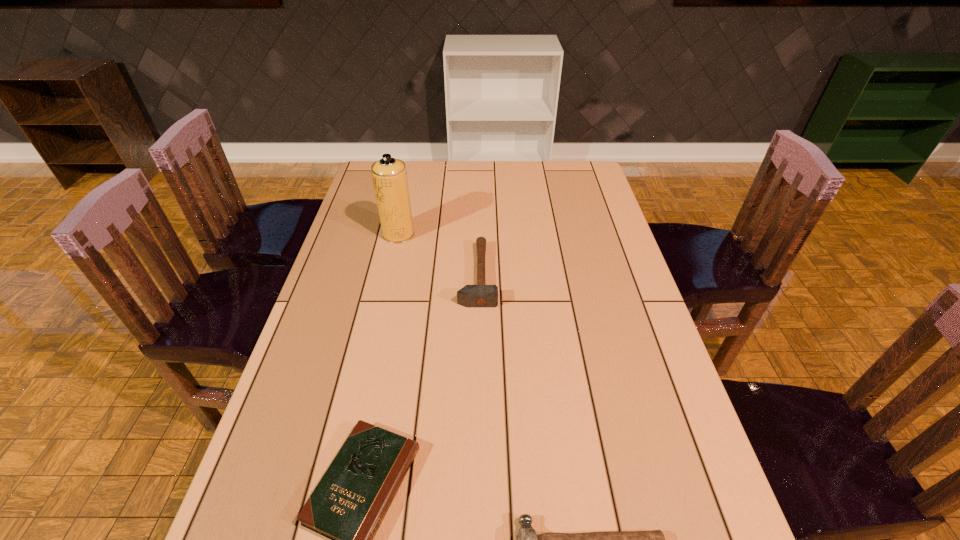
The image size is (960, 540). Find the location of `aerosol can`. aerosol can is located at coordinates (389, 175).

Where is `the farthest object`? This screenshot has width=960, height=540. the farthest object is located at coordinates (389, 175).

This screenshot has width=960, height=540. I want to click on the farther hammer, so click(x=481, y=295).

Locate an element on the screen. The width and height of the screenshot is (960, 540). the left hammer is located at coordinates (481, 295).

At what (x,y) coordinates should I click in order to perform the action: click on free space located on the left of the tallest object. Please return your answer as a coordinate pair (x, y). Looking at the image, I should click on (359, 234).

At what (x,y) coordinates should I click in order to perform the action: click on free space located on the striking surface of the left hammer. Please return your answer as a coordinate pair (x, y). The height and width of the screenshot is (540, 960). Looking at the image, I should click on (514, 275).

This screenshot has height=540, width=960. In order to click on object located in the left edge section of the desktop in this screenshot , I will do `click(389, 175)`.

You are a GUI agent. You are given a task and a screenshot of the screen. Output one action in this format:
    pyautogui.click(x=<x>, y=<y>)
    Task: Click on the vacant space at the left edge
    The height and width of the screenshot is (540, 960).
    Given the screenshot: What is the action you would take?
    pyautogui.click(x=357, y=238)

You are a GUI agent. You are given a task and a screenshot of the screen. Output one action in this format:
    pyautogui.click(x=<x>, y=<y>)
    Task: Click on the vacant space at the right edge
    The image size is (960, 540).
    Given the screenshot: What is the action you would take?
    pyautogui.click(x=584, y=258)

You are a GUI agent. You are given a task and a screenshot of the screen. Output one action in this format:
    pyautogui.click(x=<x>, y=<y>)
    Task: Click on the vacant area at the far left corner of the desktop
    
    Given the screenshot: What is the action you would take?
    pyautogui.click(x=365, y=185)